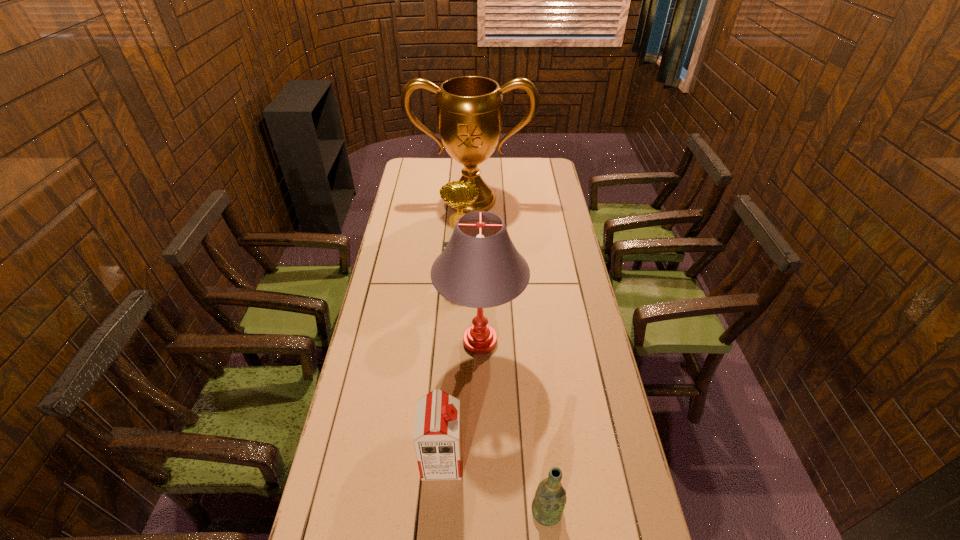
Where is `blank space located 0.200m on the front-facing side of the fourth shortest object`? The image size is (960, 540). blank space located 0.200m on the front-facing side of the fourth shortest object is located at coordinates (377, 341).

Image resolution: width=960 pixels, height=540 pixels. In order to click on free space located 0.220m on the front-facing side of the fourth shortest object in this screenshot , I will do `click(372, 341)`.

This screenshot has width=960, height=540. I want to click on vacant space located on the front-facing side of the fourth shortest object, so click(x=422, y=341).

Locate an element on the screen. This screenshot has width=960, height=540. vacant space located on the front-facing side of the fourth nearest object is located at coordinates (459, 319).

Identify the location of free spot located on the back of the soya milk. (444, 424).

You are a GUI agent. You are given a task and a screenshot of the screen. Output one action in this format:
    pyautogui.click(x=<x>, y=<y>)
    Task: Click on the object at the left edge
    
    Given the screenshot: What is the action you would take?
    pyautogui.click(x=469, y=108)

Where is `object that is at the right edge`? The height and width of the screenshot is (540, 960). object that is at the right edge is located at coordinates (469, 108).

You are a GUI agent. You are given a task and a screenshot of the screen. Output one action in this format:
    pyautogui.click(x=<x>, y=<y>)
    Task: Click on the free space at the far edge
    The width and height of the screenshot is (960, 540).
    Given the screenshot: What is the action you would take?
    pyautogui.click(x=447, y=162)

I want to click on free space at the left edge of the desktop, so click(397, 237).

The width and height of the screenshot is (960, 540). In order to click on free region at the right edge of the desktop in this screenshot , I will do `click(594, 434)`.